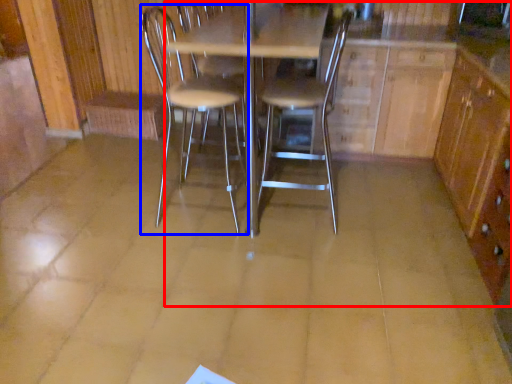
Question: Which object appears farthest to the camera in this image, dresser (highlighted by a red box) or chair (highlighted by a blue box)?

Choices:
 (A) dresser
 (B) chair

Answer: (B)